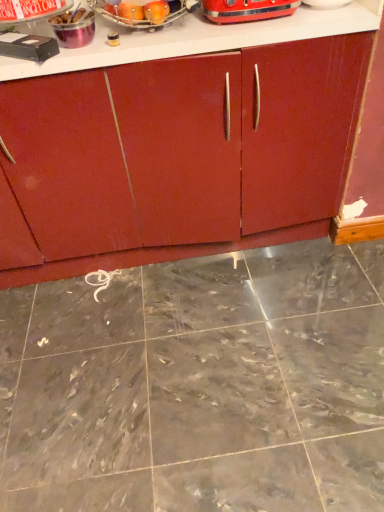
Question: Is metallic silver container at upper left, which ranks as the third appliance in right-to-left order, to the right of metallic silver toaster at upper center, arranged as the second appliance when viewed from the left, from the viewer's perspective?

Choices:
 (A) yes
 (B) no

Answer: (A)

Question: From the image's perspective, is metallic silver container at upper left, which ranks as the third appliance in right-to-left order, below metallic silver toaster at upper center, which is counted as the fourth appliance, starting from the right?

Choices:
 (A) yes
 (B) no

Answer: (A)

Question: Does metallic silver container at upper left, which ranks as the third appliance in right-to-left order, have a smaller size compared to metallic silver toaster at upper center, arranged as the second appliance when viewed from the left?

Choices:
 (A) yes
 (B) no

Answer: (A)

Question: Does metallic silver container at upper left, which ranks as the third appliance in right-to-left order, lie behind metallic silver toaster at upper center, which is counted as the fourth appliance, starting from the right?

Choices:
 (A) yes
 (B) no

Answer: (A)

Question: Is metallic silver container at upper left, which ranks as the third appliance in right-to-left order, facing away from metallic silver toaster at upper center, arranged as the second appliance when viewed from the left?

Choices:
 (A) yes
 (B) no

Answer: (B)

Question: Looking at their shapes, would you say black plastic vcr at upper left, the 1th appliance viewed from the left, is wider or thinner than shiny metallic toaster at upper center, arranged as the first appliance when viewed from the right?

Choices:
 (A) thin
 (B) wide

Answer: (A)

Question: In terms of height, does black plastic vcr at upper left, the 1th appliance viewed from the left, look taller or shorter compared to shiny metallic toaster at upper center, the fifth appliance when ordered from left to right?

Choices:
 (A) tall
 (B) short

Answer: (B)

Question: From the image's perspective, is black plastic vcr at upper left, which ranks as the 5th appliance in right-to-left order, located above or below shiny metallic toaster at upper center, the fifth appliance when ordered from left to right?

Choices:
 (A) above
 (B) below

Answer: (B)

Question: From a real-world perspective, is black plastic vcr at upper left, which ranks as the 5th appliance in right-to-left order, above or below shiny metallic toaster at upper center, arranged as the first appliance when viewed from the right?

Choices:
 (A) below
 (B) above

Answer: (A)

Question: Is point (97, 4) closer or farther from the camera than point (26, 4)?

Choices:
 (A) closer
 (B) farther

Answer: (A)

Question: In terms of width, does metallic silver fruit basket at upper center, placed as the fourth appliance when sorted from left to right, look wider or thinner when compared to metallic silver toaster at upper center, arranged as the second appliance when viewed from the left?

Choices:
 (A) thin
 (B) wide

Answer: (B)

Question: Considering their positions, is metallic silver fruit basket at upper center, the second appliance from the right, located in front of or behind metallic silver toaster at upper center, which is counted as the fourth appliance, starting from the right?

Choices:
 (A) behind
 (B) front

Answer: (A)

Question: Is metallic silver fruit basket at upper center, the second appliance from the right, taller or shorter than metallic silver toaster at upper center, which is counted as the fourth appliance, starting from the right?

Choices:
 (A) short
 (B) tall

Answer: (A)

Question: Based on their sizes in the image, would you say metallic silver container at upper left, the third appliance positioned from the left, is bigger or smaller than black plastic vcr at upper left, which ranks as the 5th appliance in right-to-left order?

Choices:
 (A) big
 (B) small

Answer: (B)

Question: Would you say metallic silver container at upper left, which ranks as the third appliance in right-to-left order, is to the left or to the right of black plastic vcr at upper left, which ranks as the 5th appliance in right-to-left order, in the picture?

Choices:
 (A) left
 (B) right

Answer: (B)